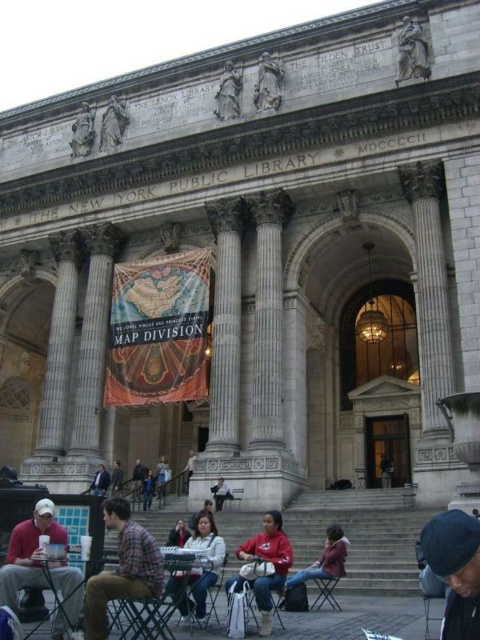
You are standing at the entrance of the New York Public Library and want to take a photo of the point at coordinates [233,108]. If your camera has a maximum zoom range of 50 meters, will you be able to capture the point clearly in your photo?

The point at coordinates [233,108] is 57.55 meters away from the camera. Since the camera can only zoom up to 50 meters, it won cannot capture the point clearly within the maximum zoom range.

In the scene shown: You are a visitor carrying a large box that measures 45 feet in length. You want to place it between the metallic silver table at center and the wooden chair at center. Is there enough space to fit the box between them?

The metallic silver table at center and wooden chair at center are 46.35 feet apart from each other. Since the box is 45 feet long, there is enough space to fit it between them as the distance between the objects is greater than the box length.